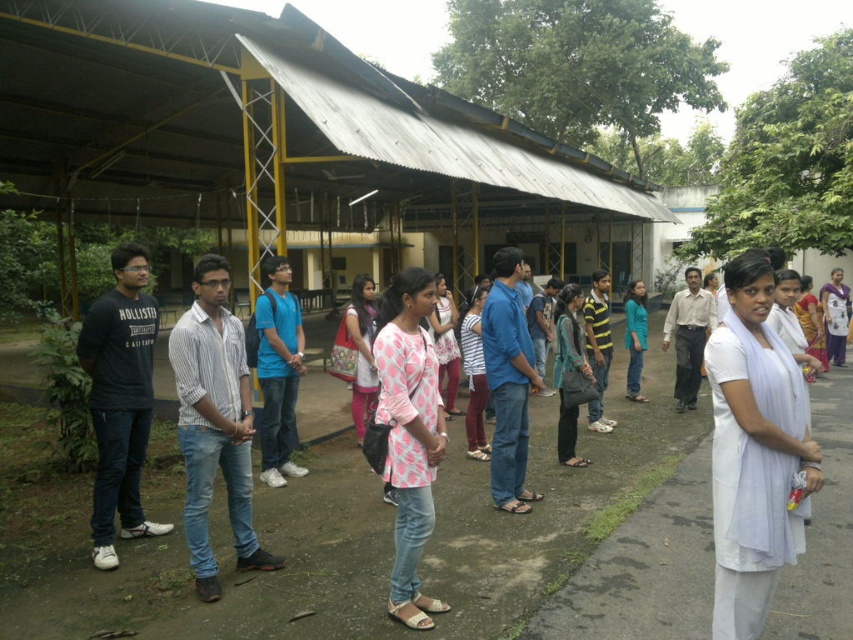
You are standing at the point labeled point (233, 508) and want to take a photo of the group of people in the scene. If your camera has a focal length of 50mm and you want to capture the entire group in the frame, which is 10 feet tall, what is the minimum distance you need to be from the group to ensure they fit in the photo?

The point labeled point (233, 508) is 14.69 feet away from the camera. To capture the entire group which is 10 feet tall, you need to be at least 14.69 feet away from the group to ensure they fit in the photo.

You are a photographer trying to capture a photo of the group. The blue jeans at center and the purple silk saree at right are two focal points. Which clothing item is shorter in height?

The blue jeans at center is shorter than the purple silk saree at right.

You are organizing a photo shoot and need to arrange two dresses in the center of the scene. The pink printed dress at center and the dotted fabric dress at center must be placed side by side. Which dress should you place on the left side to ensure they fit within a 1.2 meter wide space?

The pink printed dress at center is thinner than the dotted fabric dress at center, so placing the pink printed dress at center on the left and the dotted fabric dress at center on the right would allow them to fit within the 1.2 meter wide space since the thinner dress takes up less space.